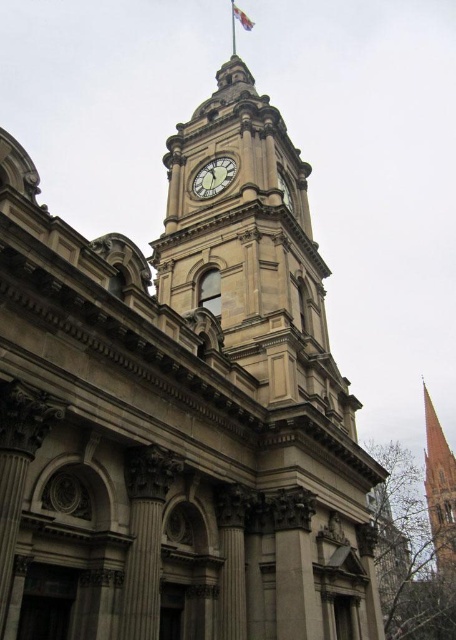
Is gold textured clock at center to the right of white fabric flag at upper center from the viewer's perspective?

No, gold textured clock at center is not to the right of white fabric flag at upper center.

This screenshot has height=640, width=456. Identify the location of gold textured clock at center. (213, 177).

The width and height of the screenshot is (456, 640). What do you see at coordinates (213, 177) in the screenshot?
I see `gold textured clock at center` at bounding box center [213, 177].

At what (x,y) coordinates should I click in order to perform the action: click on gold textured clock at center. Please return your answer as a coordinate pair (x, y). Looking at the image, I should click on (213, 177).

Does smooth stone spire at right appear on the left side of white fabric flag at upper center?

No, smooth stone spire at right is not to the left of white fabric flag at upper center.

Who is more distant from viewer, (x=450, y=563) or (x=232, y=13)?

Point (x=232, y=13)

Where is `smooth stone spire at right`? The image size is (456, 640). smooth stone spire at right is located at coordinates (440, 490).

This screenshot has height=640, width=456. What do you see at coordinates (440, 490) in the screenshot?
I see `smooth stone spire at right` at bounding box center [440, 490].

Find the location of a particular element. This screenshot has width=456, height=640. smooth stone spire at right is located at coordinates (440, 490).

Find the location of a particular element. This screenshot has height=640, width=456. smooth stone spire at right is located at coordinates (440, 490).